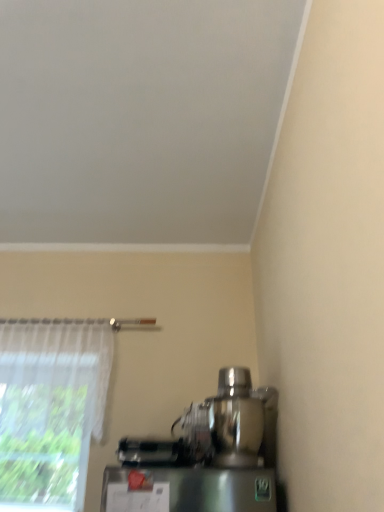
Identify the location of sheer white curtain at left. (60, 358).

What do you see at coordinates (60, 358) in the screenshot?
I see `sheer white curtain at left` at bounding box center [60, 358].

In the scene shown: What is the approximate width of shiny metallic mixer at lower right?

It is 14.23 inches.

The image size is (384, 512). Find the location of `shiny metallic mixer at lower right`. shiny metallic mixer at lower right is located at coordinates (232, 423).

The width and height of the screenshot is (384, 512). What do you see at coordinates (232, 423) in the screenshot?
I see `shiny metallic mixer at lower right` at bounding box center [232, 423].

Identify the location of sheer white curtain at left. (60, 358).

Which is more to the left, sheer white curtain at left or shiny metallic mixer at lower right?

sheer white curtain at left is more to the left.

From the picture: Is the position of sheer white curtain at left more distant than that of shiny metallic mixer at lower right?

Yes, sheer white curtain at left is further from the viewer.

Considering the positions of point (28, 379) and point (272, 440), is point (28, 379) closer or farther from the camera than point (272, 440)?

Point (28, 379) is positioned farther from the camera compared to point (272, 440).

From the picture: From the image's perspective, is sheer white curtain at left beneath shiny metallic mixer at lower right?

Actually, sheer white curtain at left appears above shiny metallic mixer at lower right in the image.

From a real-world perspective, between sheer white curtain at left and shiny metallic mixer at lower right, who is vertically lower?

shiny metallic mixer at lower right.

Which of these two, sheer white curtain at left or shiny metallic mixer at lower right, is wider?

shiny metallic mixer at lower right.

Is sheer white curtain at left taller or shorter than shiny metallic mixer at lower right?

Clearly, sheer white curtain at left is taller compared to shiny metallic mixer at lower right.

Which of these two, sheer white curtain at left or shiny metallic mixer at lower right, is bigger?

Bigger between the two is sheer white curtain at left.

Consider the image. Is sheer white curtain at left inside the boundaries of shiny metallic mixer at lower right, or outside?

sheer white curtain at left is spatially situated outside shiny metallic mixer at lower right.

Are sheer white curtain at left and shiny metallic mixer at lower right beside each other?

No, sheer white curtain at left is not beside shiny metallic mixer at lower right.

Is sheer white curtain at left oriented towards shiny metallic mixer at lower right?

No, sheer white curtain at left does not turn towards shiny metallic mixer at lower right.

How different are the orientations of sheer white curtain at left and shiny metallic mixer at lower right in degrees?

178 degrees separate the facing orientations of sheer white curtain at left and shiny metallic mixer at lower right.

Locate an element on the screen. curtain above the shiny metallic mixer at lower right (from a real-world perspective) is located at coordinates (60, 358).

Is shiny metallic mixer at lower right to the right of sheer white curtain at left from the viewer's perspective?

Yes.

Does shiny metallic mixer at lower right come in front of sheer white curtain at left?

Yes, shiny metallic mixer at lower right is closer to the camera.

Is point (178, 421) closer or farther from the camera than point (29, 336)?

Point (178, 421) is closer to the camera than point (29, 336).

From the image's perspective, is shiny metallic mixer at lower right beneath sheer white curtain at left?

Indeed, from the image's perspective, shiny metallic mixer at lower right is shown beneath sheer white curtain at left.

From a real-world perspective, which is physically above, shiny metallic mixer at lower right or sheer white curtain at left?

sheer white curtain at left is physically above.

Considering the sizes of objects shiny metallic mixer at lower right and sheer white curtain at left in the image provided, who is wider, shiny metallic mixer at lower right or sheer white curtain at left?

shiny metallic mixer at lower right is wider.

From the picture: Does shiny metallic mixer at lower right have a greater height compared to sheer white curtain at left?

In fact, shiny metallic mixer at lower right may be shorter than sheer white curtain at left.

Considering the relative sizes of shiny metallic mixer at lower right and sheer white curtain at left in the image provided, is shiny metallic mixer at lower right smaller than sheer white curtain at left?

Yes.

Is sheer white curtain at left completely or partially inside shiny metallic mixer at lower right?

Definitely not — sheer white curtain at left is not inside shiny metallic mixer at lower right.

Is shiny metallic mixer at lower right directly adjacent to sheer white curtain at left?

No, shiny metallic mixer at lower right is not next to sheer white curtain at left.

Is shiny metallic mixer at lower right facing towards sheer white curtain at left?

No, shiny metallic mixer at lower right is not oriented towards sheer white curtain at left.

Based on the photo, how many degrees apart are the facing directions of shiny metallic mixer at lower right and sheer white curtain at left?

178 degrees separate the facing orientations of shiny metallic mixer at lower right and sheer white curtain at left.

Locate an element on the screen. curtain above the shiny metallic mixer at lower right (from a real-world perspective) is located at coordinates (60, 358).

Locate an element on the screen. This screenshot has width=384, height=512. curtain above the shiny metallic mixer at lower right (from a real-world perspective) is located at coordinates (60, 358).

You are a GUI agent. You are given a task and a screenshot of the screen. Output one action in this format:
    pyautogui.click(x=<x>, y=<y>)
    Task: Click on the curtain that is behind the shiny metallic mixer at lower right
    The height and width of the screenshot is (512, 384).
    Given the screenshot: What is the action you would take?
    pyautogui.click(x=60, y=358)